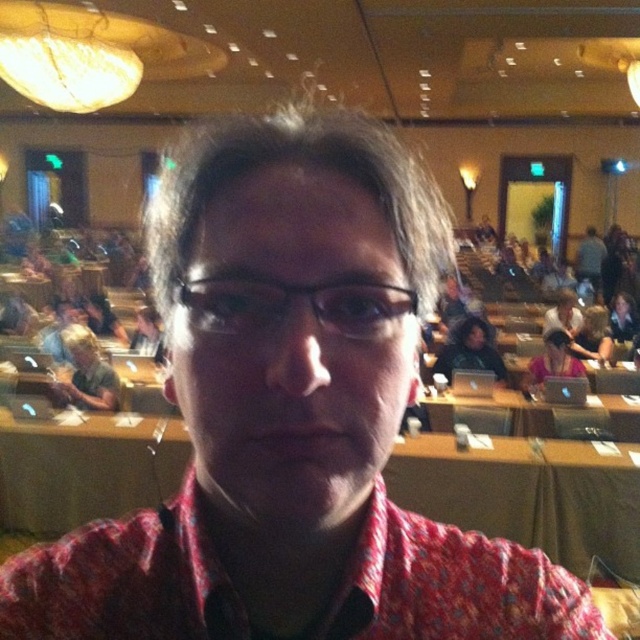
Between black plastic glasses at center and matte black laptop at upper right, which one is positioned higher?

matte black laptop at upper right

Does black plastic glasses at center appear over matte black laptop at upper right?

No.

Does point (224, 296) come in front of point (593, 237)?

That is True.

Find the location of a particular element. The height and width of the screenshot is (640, 640). black plastic glasses at center is located at coordinates (291, 301).

Between wooden table at center and black plastic glasses at center, which one is positioned lower?

wooden table at center is below.

In order to click on wooden table at center in this screenshot , I will do `click(528, 493)`.

Who is more forward, [506,465] or [349,324]?

Point [349,324] is more forward.

In order to click on wooden table at center in this screenshot , I will do (x=528, y=493).

Is wooden table at center to the left of matte black laptop at upper right from the viewer's perspective?

Correct, you'll find wooden table at center to the left of matte black laptop at upper right.

Is point (36, 429) positioned after point (586, 262)?

No, it is not.

Where is `wooden table at center`? The height and width of the screenshot is (640, 640). wooden table at center is located at coordinates (528, 493).